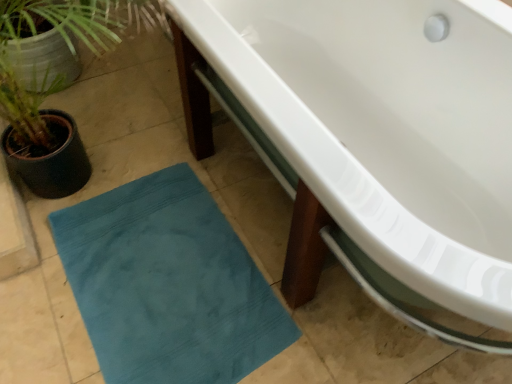
Question: Should I look upward or downward to see green textured plant at left?

Choices:
 (A) down
 (B) up

Answer: (B)

Question: From the image's perspective, is teal fabric bath mat at lower left located beneath green textured plant at left?

Choices:
 (A) yes
 (B) no

Answer: (A)

Question: Can you confirm if teal fabric bath mat at lower left is thinner than green textured plant at left?

Choices:
 (A) no
 (B) yes

Answer: (B)

Question: Can you confirm if teal fabric bath mat at lower left is smaller than green textured plant at left?

Choices:
 (A) no
 (B) yes

Answer: (B)

Question: Does teal fabric bath mat at lower left have a greater width compared to green textured plant at left?

Choices:
 (A) no
 (B) yes

Answer: (A)

Question: Is teal fabric bath mat at lower left at the left side of green textured plant at left?

Choices:
 (A) no
 (B) yes

Answer: (A)

Question: From the image's perspective, is teal fabric bath mat at lower left above green textured plant at left?

Choices:
 (A) yes
 (B) no

Answer: (B)

Question: From a real-world perspective, is white glossy bathtub at center positioned over green textured plant at left based on gravity?

Choices:
 (A) yes
 (B) no

Answer: (B)

Question: Is green textured plant at left inside white glossy bathtub at center?

Choices:
 (A) yes
 (B) no

Answer: (B)

Question: Does white glossy bathtub at center come behind green textured plant at left?

Choices:
 (A) yes
 (B) no

Answer: (B)

Question: Can you confirm if white glossy bathtub at center is positioned to the left of green textured plant at left?

Choices:
 (A) yes
 (B) no

Answer: (B)

Question: Is white glossy bathtub at center placed right next to green textured plant at left?

Choices:
 (A) no
 (B) yes

Answer: (A)

Question: Is white glossy bathtub at center positioned with its back to green textured plant at left?

Choices:
 (A) yes
 (B) no

Answer: (B)

Question: From a real-world perspective, is white glossy bathtub at center positioned over teal fabric bath mat at lower left based on gravity?

Choices:
 (A) no
 (B) yes

Answer: (B)